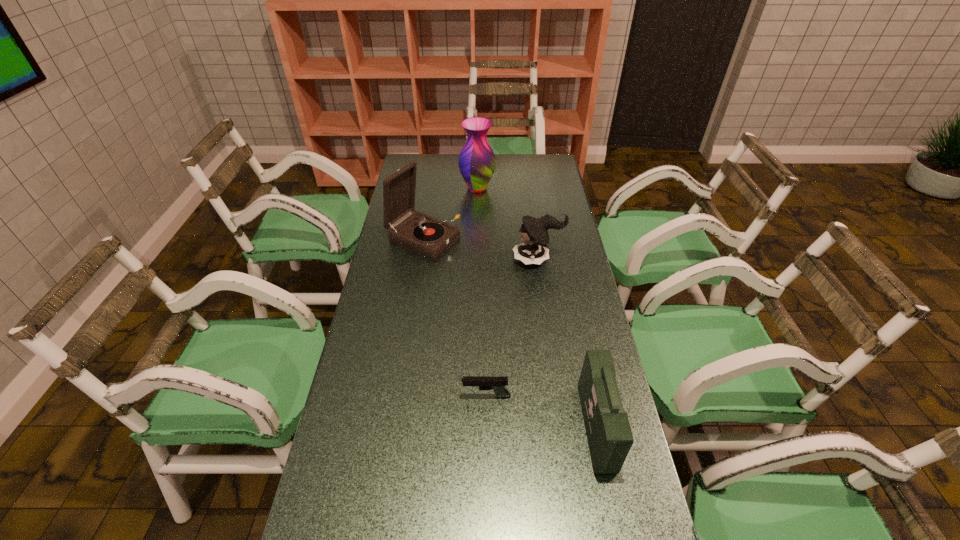
Locate an element on the screen. The width and height of the screenshot is (960, 540). vacant space at the far edge of the desktop is located at coordinates (492, 179).

Find the location of a particular element. This screenshot has width=960, height=540. vacant space at the left edge of the desktop is located at coordinates (385, 298).

The height and width of the screenshot is (540, 960). Find the location of `vacant point at the right edge`. vacant point at the right edge is located at coordinates click(x=569, y=376).

The width and height of the screenshot is (960, 540). I want to click on vacant space that is in between the doll and the phonograph record, so click(x=480, y=249).

I want to click on empty space that is in between the vase and the doll, so (x=508, y=224).

Image resolution: width=960 pixels, height=540 pixels. I want to click on vacant area that lies between the phonograph record and the first-aid kit, so click(510, 334).

Identify the location of free space between the vase and the first-aid kit. (537, 308).

Find the location of a particular element. The height and width of the screenshot is (540, 960). empty location between the pistol and the first-aid kit is located at coordinates [x=541, y=412].

Where is `free space between the farthest object and the first-aid kit`? This screenshot has width=960, height=540. free space between the farthest object and the first-aid kit is located at coordinates (537, 308).

In order to click on vacant area between the doll and the first-aid kit in this screenshot , I will do `click(567, 343)`.